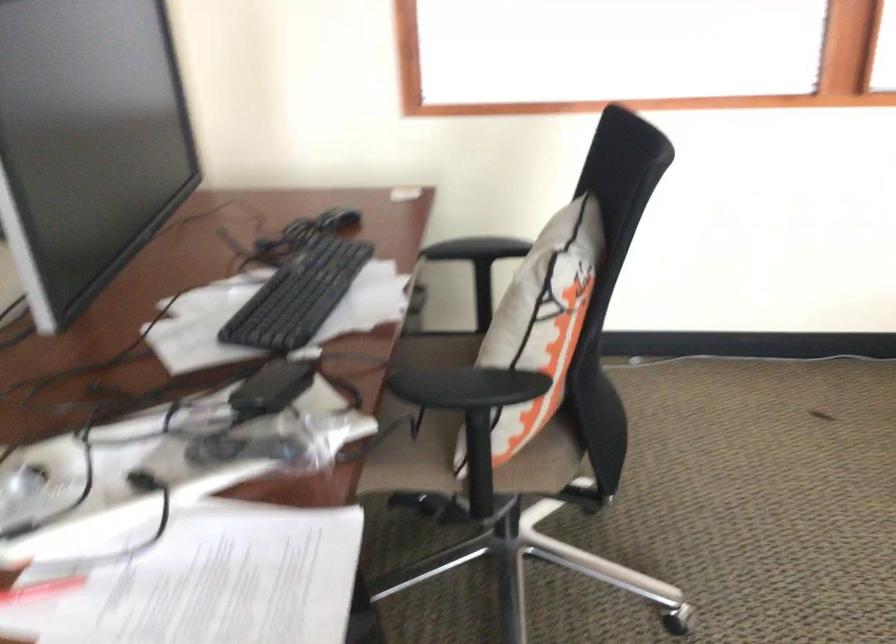
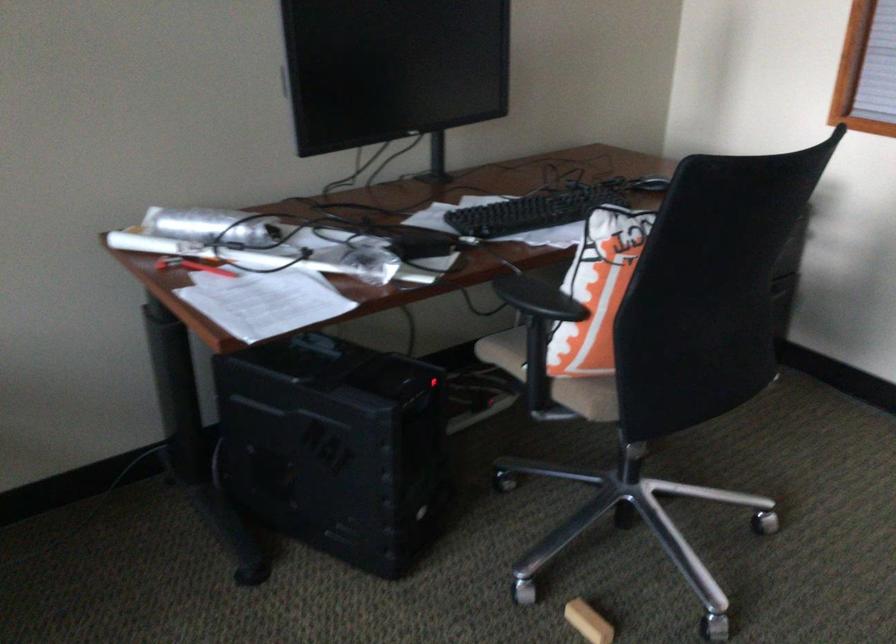
In the second image, find the point that corresponds to the point at 495,384 in the first image.

(538, 299)